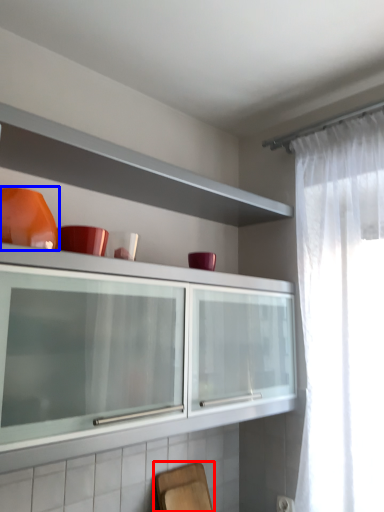
Question: Which of the following is the farthest to the observer, chair (highlighted by a red box) or tableware (highlighted by a blue box)?

Choices:
 (A) chair
 (B) tableware

Answer: (A)